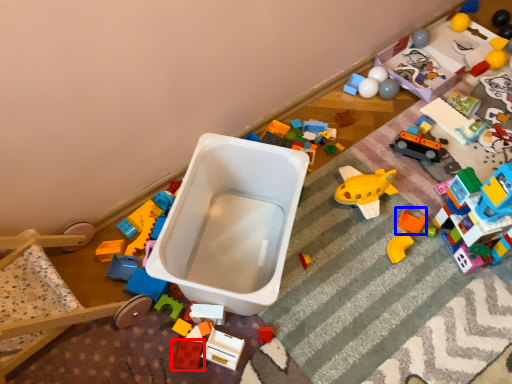
Question: Which of the following is the closest to the observer, toy (highlighted by a red box) or toy (highlighted by a blue box)?

Choices:
 (A) toy
 (B) toy

Answer: (A)